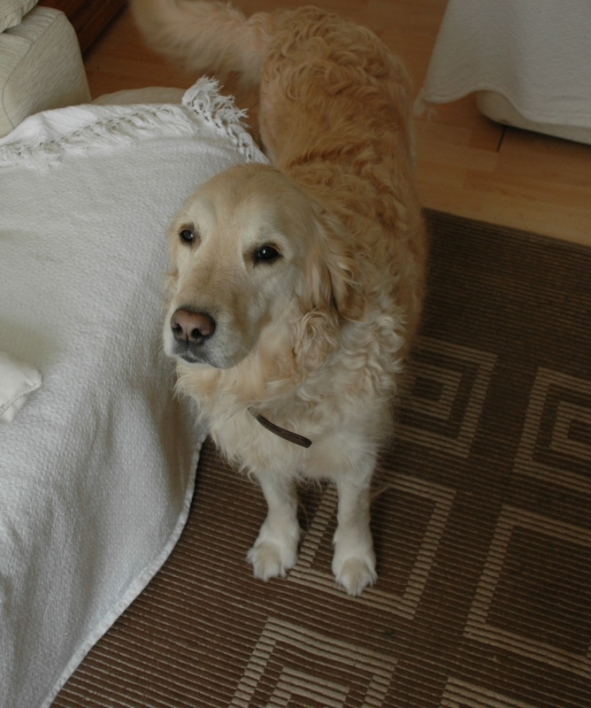
Find the location of a particular element. part of the couch is located at coordinates (38, 64), (128, 93).